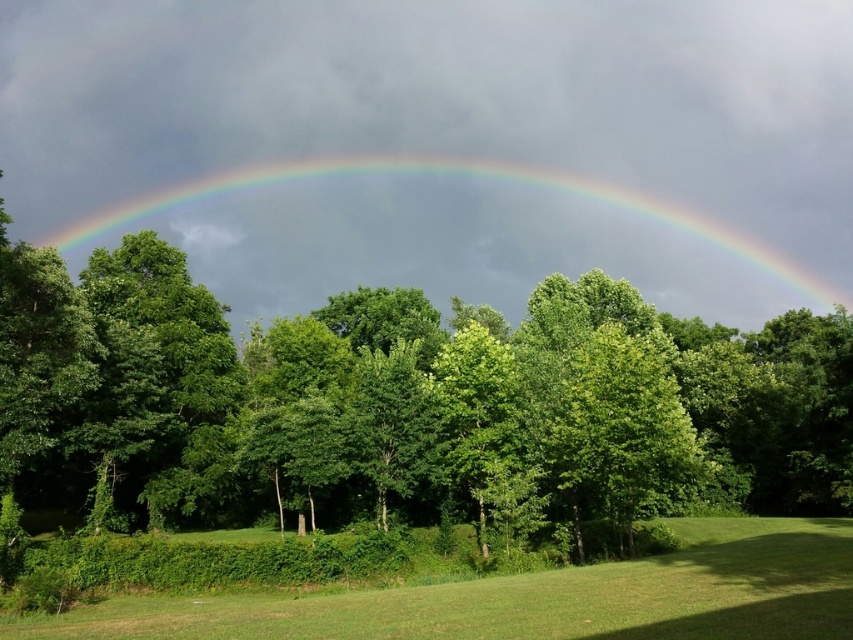
Question: Which object is the closest to the rainbow at upper center?

Choices:
 (A) green grass at lower center
 (B) green leafy tree at center

Answer: (B)

Question: Estimate the real-world distances between objects in this image. Which object is closer to the rainbow at upper center?

Choices:
 (A) green leafy tree at center
 (B) green grass at lower center

Answer: (A)

Question: Does green leafy tree at center appear on the left side of rainbow at upper center?

Choices:
 (A) yes
 (B) no

Answer: (B)

Question: Can you confirm if green leafy tree at center is positioned to the right of green grass at lower center?

Choices:
 (A) yes
 (B) no

Answer: (B)

Question: Is the position of green leafy tree at center less distant than that of rainbow at upper center?

Choices:
 (A) no
 (B) yes

Answer: (B)

Question: Which object is closer to the camera taking this photo?

Choices:
 (A) rainbow at upper center
 (B) green leafy tree at center
 (C) green grass at lower center

Answer: (C)